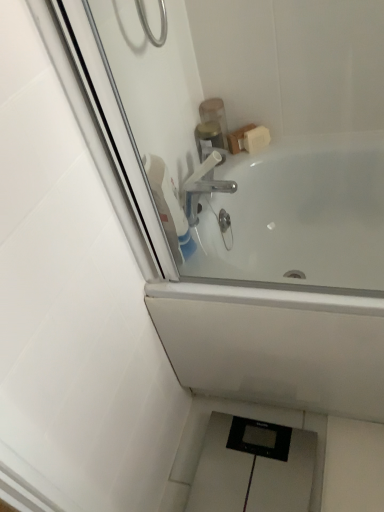
Question: Which is correct: polished chrome faucet at upper center is inside white plastic tap at upper center, or outside of it?

Choices:
 (A) inside
 (B) outside

Answer: (B)

Question: Relative to white plastic tap at upper center, is polished chrome faucet at upper center in front or behind?

Choices:
 (A) behind
 (B) front

Answer: (A)

Question: Which of these objects is positioned farthest from the translucent plastic soap dispenser at upper center, positioned as the second toiletry in bottom-to-top order?

Choices:
 (A) white glossy bathtub at upper center
 (B) translucent plastic container at upper center, positioned as the second toiletry in top-to-bottom order
 (C) polished chrome faucet at upper center
 (D) white plastic tap at upper center

Answer: (A)

Question: Which of these objects is positioned closest to the translucent plastic soap dispenser at upper center, placed as the 1th toiletry when sorted from top to bottom?

Choices:
 (A) white plastic tap at upper center
 (B) translucent plastic container at upper center, positioned as the second toiletry in top-to-bottom order
 (C) white glossy bathtub at upper center
 (D) polished chrome faucet at upper center

Answer: (B)